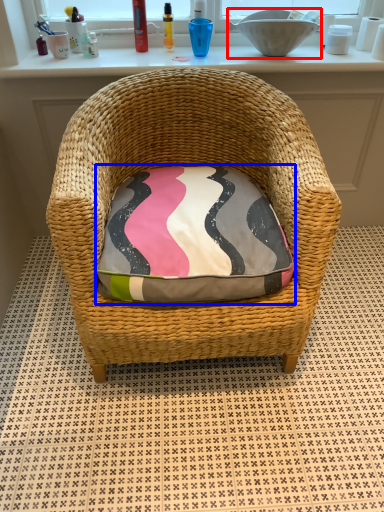
Question: Which of the following is the farthest to the observer, sink (highlighted by a red box) or throw pillow (highlighted by a blue box)?

Choices:
 (A) sink
 (B) throw pillow

Answer: (A)